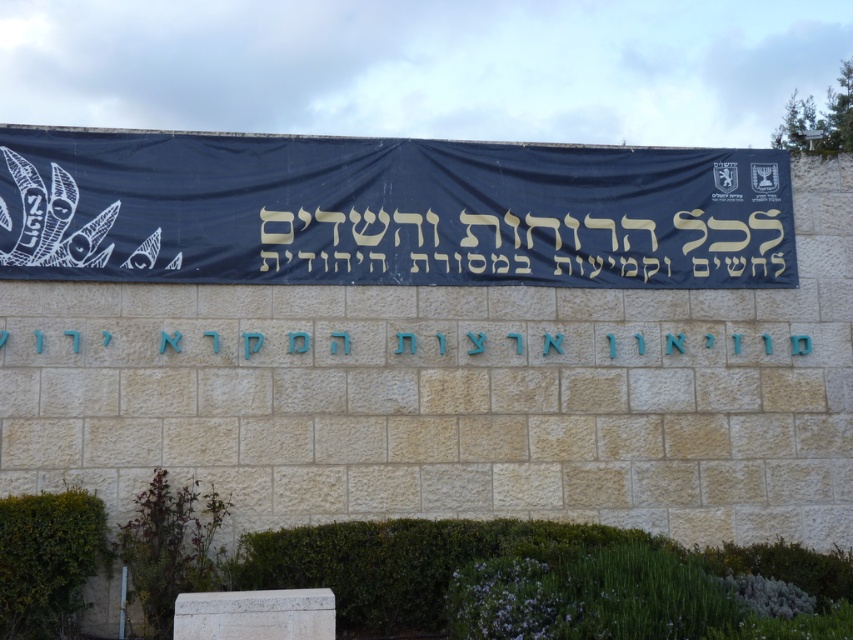
You are standing in front of a stone wall with a banner. There is a point marked at coordinates [387,211]. What object is located at that point?

The point at coordinates [387,211] indicates the location of the black fabric banner at center.

You are an architect reviewing a design for a historical building. You notice the black fabric banner at center and the blue stone sign at center. According to the design, which object is placed to the right of the other?

The black fabric banner at center is positioned on the right side of blue stone sign at center.